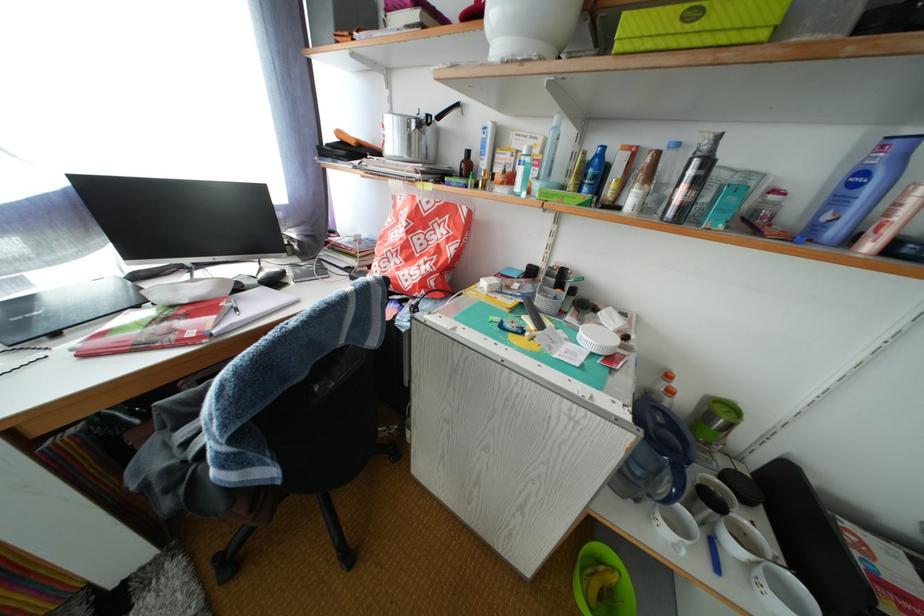
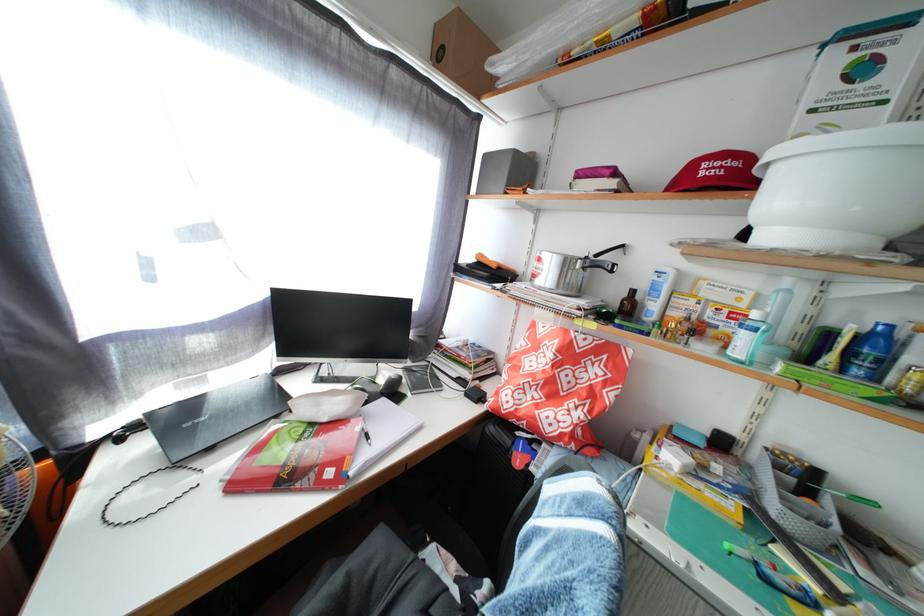
In the second image, find the point that corresponds to point (464, 166) in the first image.

(621, 301)